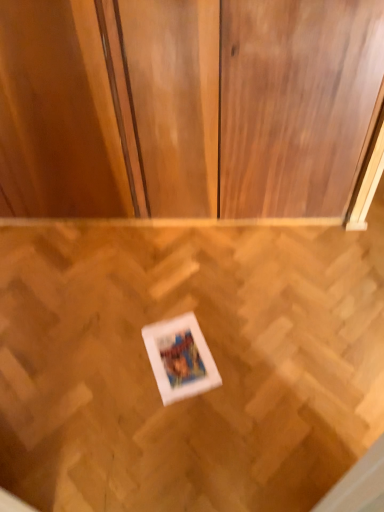
Identify the location of matte wood dresser at center. (205, 113).

Identify the location of wooden parquet floor at center. The image size is (384, 512). (213, 356).

Is white matte picture frame at center with wooden parquet floor at center?

Answer: No, white matte picture frame at center is not beside wooden parquet floor at center.

Is white matte picture frame at center turned away from wooden parquet floor at center?

Yes, white matte picture frame at center is facing away from wooden parquet floor at center.

In the image, is white matte picture frame at center on the left side or the right side of wooden parquet floor at center?

Clearly, white matte picture frame at center is on the left of wooden parquet floor at center in the image.

In terms of width, does white matte picture frame at center look wider or thinner when compared to wooden parquet floor at center?

white matte picture frame at center is thinner than wooden parquet floor at center.

From the image's perspective, which is below, matte wood dresser at center or wooden parquet floor at center?

wooden parquet floor at center, from the image's perspective.

Between matte wood dresser at center and wooden parquet floor at center, which one is positioned behind?

matte wood dresser at center is further from the camera.

Would you say matte wood dresser at center is inside or outside wooden parquet floor at center?

matte wood dresser at center is located beyond the bounds of wooden parquet floor at center.

In the image, there is a wooden parquet floor at center. At what (x,y) coordinates should I click in order to perform the action: click on dresser above it (from the image's perspective). Please return your answer as a coordinate pair (x, y). This screenshot has width=384, height=512. Looking at the image, I should click on (205, 113).

Which object is positioned more to the left, white matte picture frame at center or matte wood dresser at center?

Positioned to the left is matte wood dresser at center.

Is white matte picture frame at center closer to the viewer compared to matte wood dresser at center?

No, the depth of white matte picture frame at center is greater than that of matte wood dresser at center.

Is white matte picture frame at center facing towards matte wood dresser at center?

No.

Considering the points (166, 369) and (271, 202), which point is behind, point (166, 369) or point (271, 202)?

Point (271, 202)

Can you confirm if wooden parquet floor at center is smaller than white matte picture frame at center?

Actually, wooden parquet floor at center might be larger than white matte picture frame at center.

Based on their positions, is wooden parquet floor at center located to the left or right of white matte picture frame at center?

wooden parquet floor at center is to the right of white matte picture frame at center.

In the scene shown: Considering the sizes of objects wooden parquet floor at center and white matte picture frame at center in the image provided, who is shorter, wooden parquet floor at center or white matte picture frame at center?

Standing shorter between the two is white matte picture frame at center.

Between wooden parquet floor at center and white matte picture frame at center, which one has larger width?

wooden parquet floor at center is wider.

Looking at this image, which is correct: matte wood dresser at center is inside white matte picture frame at center, or outside of it?

matte wood dresser at center is not inside white matte picture frame at center, it's outside.

How many degrees apart are the facing directions of matte wood dresser at center and white matte picture frame at center?

There is a 19.8-degree angle between the facing directions of matte wood dresser at center and white matte picture frame at center.

From a real-world perspective, between matte wood dresser at center and white matte picture frame at center, who is vertically higher?

From a 3D spatial view, matte wood dresser at center is above.

Is matte wood dresser at center facing away from white matte picture frame at center?

No.

Find the location of `dresser that appears behind the wooden parquet floor at center`. dresser that appears behind the wooden parquet floor at center is located at coordinates (205, 113).

From a real-world perspective, is wooden parquet floor at center beneath matte wood dresser at center?

Yes, from a real-world perspective, wooden parquet floor at center is beneath matte wood dresser at center.

Choose the correct answer: Is wooden parquet floor at center inside matte wood dresser at center or outside it?

wooden parquet floor at center is not inside matte wood dresser at center, it's outside.

Is there a large distance between wooden parquet floor at center and matte wood dresser at center?

They are positioned close to each other.

What are the coordinates of `plywood in front of the white matte picture frame at center` in the screenshot? It's located at (213, 356).

Identify the location of dresser behind the wooden parquet floor at center. (205, 113).

Estimate the real-world distances between objects in this image. Which object is further from white matte picture frame at center, wooden parquet floor at center or matte wood dresser at center?

matte wood dresser at center.

Based on their spatial positions, is white matte picture frame at center or wooden parquet floor at center closer to matte wood dresser at center?

wooden parquet floor at center is positioned closer to the anchor matte wood dresser at center.

From the image, which object appears to be nearer to white matte picture frame at center, matte wood dresser at center or wooden parquet floor at center?

Based on the image, wooden parquet floor at center appears to be nearer to white matte picture frame at center.

Considering their positions, is wooden parquet floor at center positioned closer to matte wood dresser at center than white matte picture frame at center?

wooden parquet floor at center is closer to matte wood dresser at center.

Estimate the real-world distances between objects in this image. Which object is closer to wooden parquet floor at center, matte wood dresser at center or white matte picture frame at center?

Based on the image, white matte picture frame at center appears to be nearer to wooden parquet floor at center.

Based on their spatial positions, is white matte picture frame at center or matte wood dresser at center closer to wooden parquet floor at center?

white matte picture frame at center is closer to wooden parquet floor at center.

You are a GUI agent. You are given a task and a screenshot of the screen. Output one action in this format:
    pyautogui.click(x=<x>, y=<y>)
    Task: Click on the plywood between matte wood dresser at center and white matte picture frame at center in the vertical direction
    The height and width of the screenshot is (512, 384).
    Given the screenshot: What is the action you would take?
    pyautogui.click(x=213, y=356)